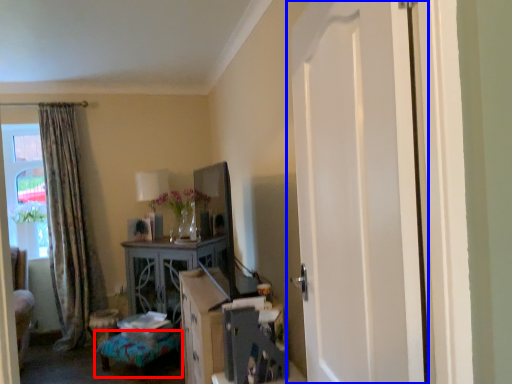
Question: Among these objects, which one is farthest to the camera, furniture (highlighted by a red box) or door (highlighted by a blue box)?

Choices:
 (A) furniture
 (B) door

Answer: (A)